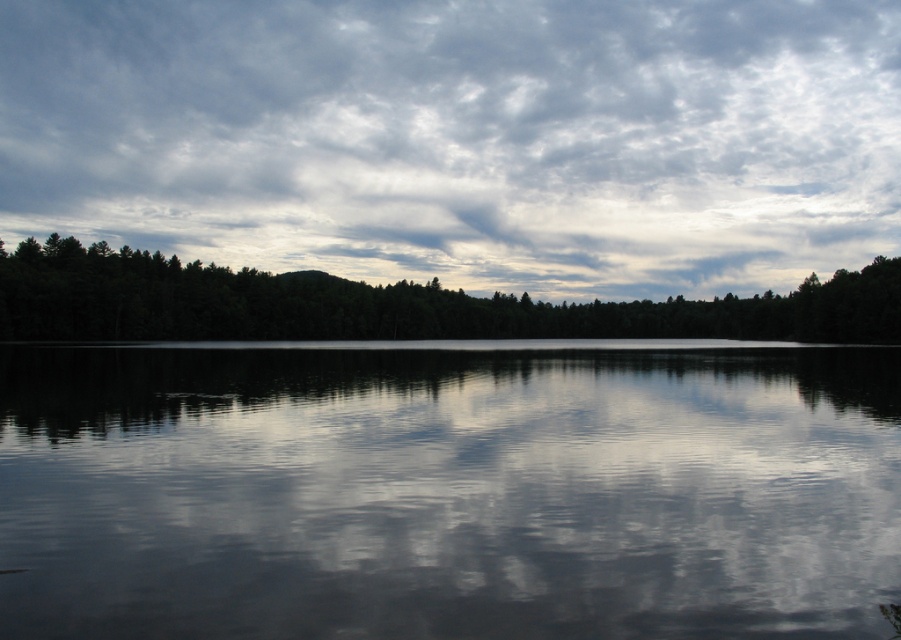
Question: Does smooth water at center have a larger size compared to cloudy sky at upper center?

Choices:
 (A) yes
 (B) no

Answer: (B)

Question: Which of the following is the farthest from the observer?

Choices:
 (A) smooth water at center
 (B) cloudy sky at upper center
 (C) green matte forest at center

Answer: (B)

Question: Where is smooth water at center located in relation to green matte forest at center in the image?

Choices:
 (A) right
 (B) left

Answer: (B)

Question: Based on their relative distances, which object is farther from the smooth water at center?

Choices:
 (A) cloudy sky at upper center
 (B) green matte forest at center

Answer: (A)

Question: Is cloudy sky at upper center further to the viewer compared to green matte forest at center?

Choices:
 (A) no
 (B) yes

Answer: (B)

Question: Which of the following is the farthest from the observer?

Choices:
 (A) smooth water at center
 (B) green matte forest at center
 (C) cloudy sky at upper center

Answer: (C)